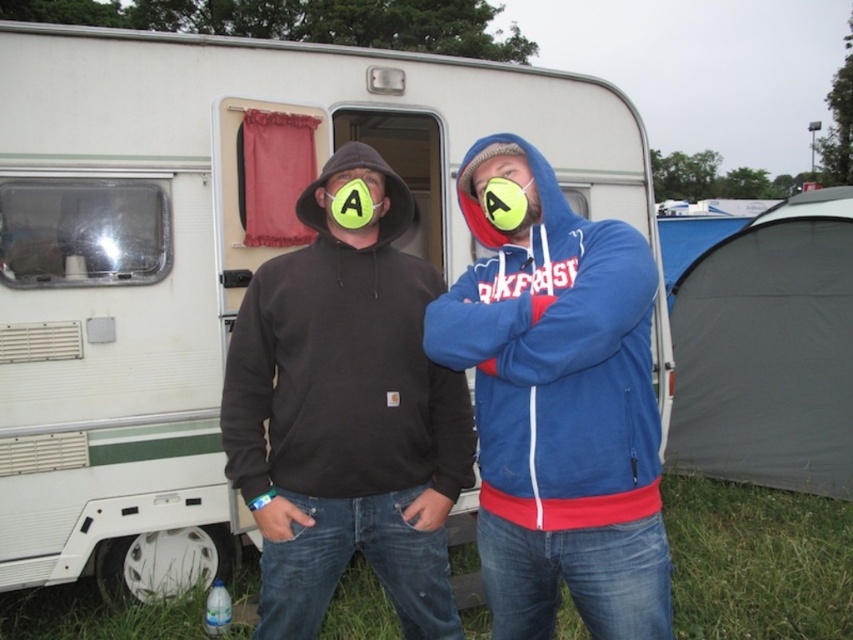
Does dark gray fabric tent at right appear on the left side of matte black hoodie at center?

In fact, dark gray fabric tent at right is to the right of matte black hoodie at center.

Is point (831, 486) behind point (340, 192)?

That is True.

Does point (682, 401) come in front of point (380, 177)?

No, it is behind (380, 177).

At what (x,y) coordinates should I click in order to perform the action: click on dark gray fabric tent at right. Please return your answer as a coordinate pair (x, y). The height and width of the screenshot is (640, 853). Looking at the image, I should click on (769, 349).

Between blue fleece jacket at center and dark gray fabric tent at right, which one has more height?

With more height is dark gray fabric tent at right.

Does point (587, 550) come behind point (730, 388)?

No, it is in front of (730, 388).

Where is `blue fleece jacket at center`? This screenshot has width=853, height=640. blue fleece jacket at center is located at coordinates (560, 413).

At what (x,y) coordinates should I click in order to perform the action: click on white plastic trailer at center. Please return your answer as a coordinate pair (x, y). This screenshot has height=640, width=853. Looking at the image, I should click on (207, 257).

This screenshot has height=640, width=853. Find the location of `white plastic trailer at center`. white plastic trailer at center is located at coordinates (207, 257).